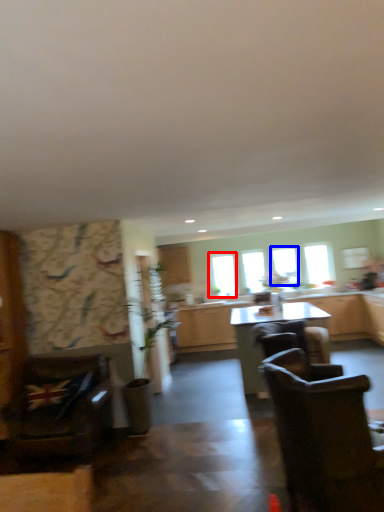
Question: Which of the following is the closest to the observer, window (highlighted by a red box) or window (highlighted by a blue box)?

Choices:
 (A) window
 (B) window

Answer: (B)